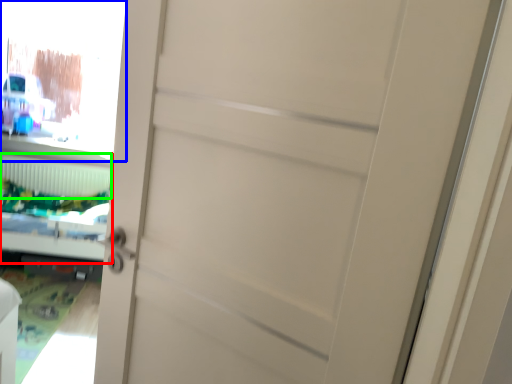
Question: Considering the real-world distances, which object is farthest from bed (highlighted by a red box)? window screen (highlighted by a blue box) or radiator (highlighted by a green box)?

Choices:
 (A) window screen
 (B) radiator

Answer: (A)